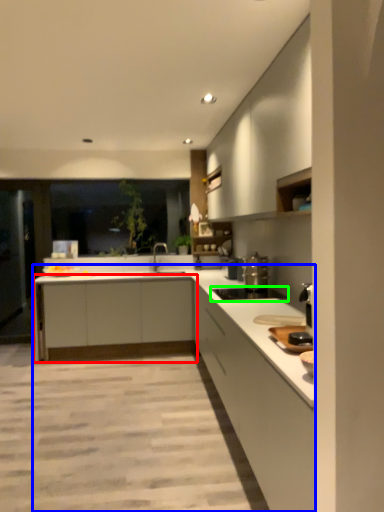
Question: Which object is positioned farthest from cabinetry (highlighted by a red box)? Select from countertop (highlighted by a blue box) and appliance (highlighted by a green box).

Choices:
 (A) countertop
 (B) appliance

Answer: (B)